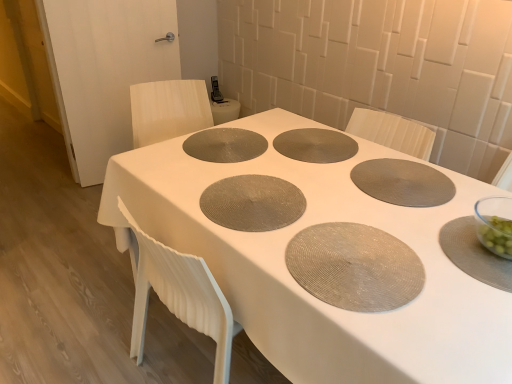
The width and height of the screenshot is (512, 384). What are the coordinates of `vacant space in between matte gray placemat at center, which appears as the first oval when viewed from the front, and matte gray placemat at center right, which ranks as the third pizza pan in left-to-right order` in the screenshot? It's located at (386, 211).